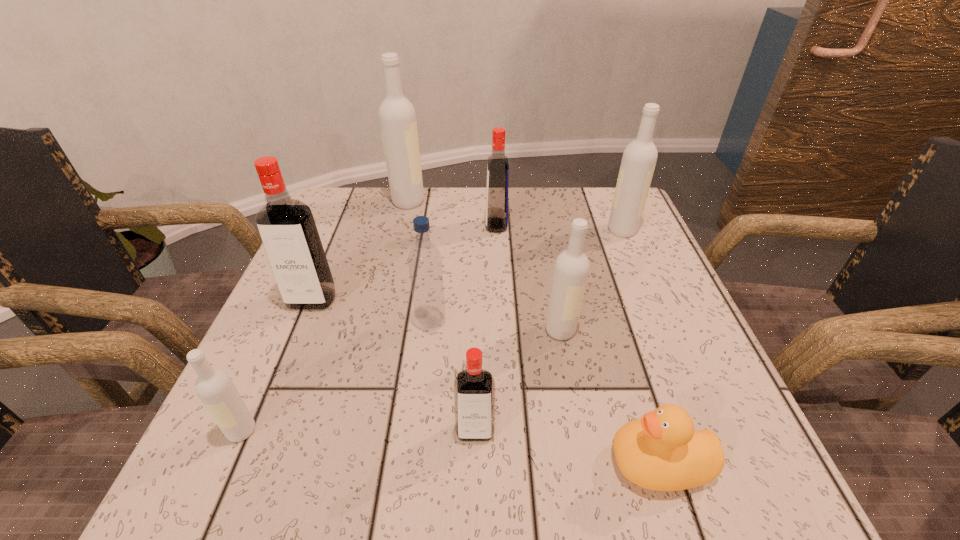
Find the location of a particular element. The height and width of the screenshot is (540, 960). free space between the shortest object and the rightmost vodka is located at coordinates (641, 347).

Image resolution: width=960 pixels, height=540 pixels. Identify the location of vacant space that's between the water bottle and the second smallest red vodka. (464, 273).

Where is `vacant point located between the farthest vodka and the farthest red vodka`? The width and height of the screenshot is (960, 540). vacant point located between the farthest vodka and the farthest red vodka is located at coordinates (452, 213).

Locate an element on the screen. The image size is (960, 540). free area in between the fourth nearest vodka and the rightmost white vodka is located at coordinates (467, 265).

What are the coordinates of `unoccupied position between the duck and the third white vodka from left to right` in the screenshot? It's located at (611, 397).

Where is `empty space between the duck and the nearest white vodka`? The width and height of the screenshot is (960, 540). empty space between the duck and the nearest white vodka is located at coordinates (451, 447).

At what (x,y) coordinates should I click in order to perform the action: click on vacant space that's between the water bottle and the biggest red vodka. Please return your answer as a coordinate pair (x, y). This screenshot has height=540, width=960. Looking at the image, I should click on (372, 311).

You are a GUI agent. You are given a task and a screenshot of the screen. Output one action in this format:
    pyautogui.click(x=<x>, y=<y>)
    Task: Click on the free point between the farthest red vodka and the yellow duck
    
    Given the screenshot: What is the action you would take?
    pyautogui.click(x=578, y=344)

Where is `vacant region between the second vodka from right to left and the blue water bottle`? vacant region between the second vodka from right to left and the blue water bottle is located at coordinates (496, 326).

Where is `object that ranks as the third closest to the third object from right to left`? The height and width of the screenshot is (540, 960). object that ranks as the third closest to the third object from right to left is located at coordinates (474, 388).